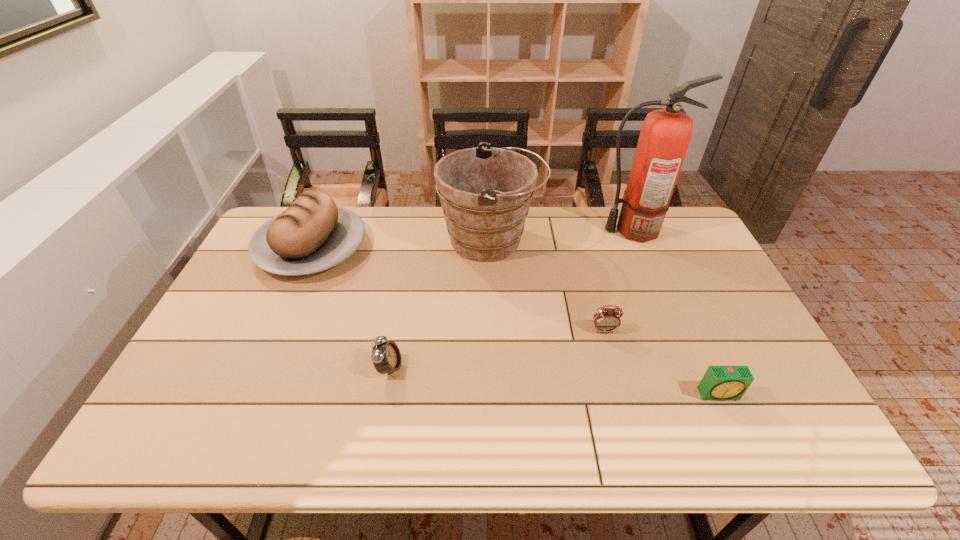
What are the coordinates of `bucket positioned at the far edge` in the screenshot? It's located at (485, 192).

This screenshot has width=960, height=540. Identify the location of bread at the far edge. (313, 234).

This screenshot has width=960, height=540. Find the location of `object present at the left edge`. object present at the left edge is located at coordinates (313, 234).

This screenshot has width=960, height=540. I want to click on fire extinguisher at the right edge, so click(x=665, y=135).

The image size is (960, 540). What are the coordinates of `alarm clock situated at the right edge` in the screenshot? It's located at (720, 383).

This screenshot has width=960, height=540. In order to click on object positioned at the far left corner in this screenshot , I will do `click(313, 234)`.

The height and width of the screenshot is (540, 960). I want to click on object that is at the far right corner, so click(665, 135).

Identify the location of free space at the far edge of the desktop. This screenshot has height=540, width=960. (419, 246).

Locate an element on the screen. This screenshot has height=540, width=960. free space at the near edge is located at coordinates (587, 437).

Locate an element on the screen. This screenshot has width=960, height=540. free space at the right edge of the desktop is located at coordinates (702, 292).